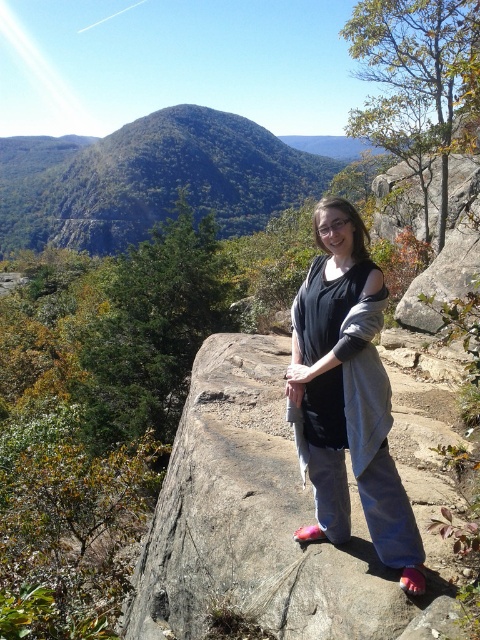
From the picture: Does gray/rough rock at center have a larger size compared to gray cotton sweater at center?

No, gray/rough rock at center is not bigger than gray cotton sweater at center.

Where is `gray/rough rock at center`? The height and width of the screenshot is (640, 480). gray/rough rock at center is located at coordinates pos(280,515).

Locate an element on the screen. The height and width of the screenshot is (640, 480). gray/rough rock at center is located at coordinates (280, 515).